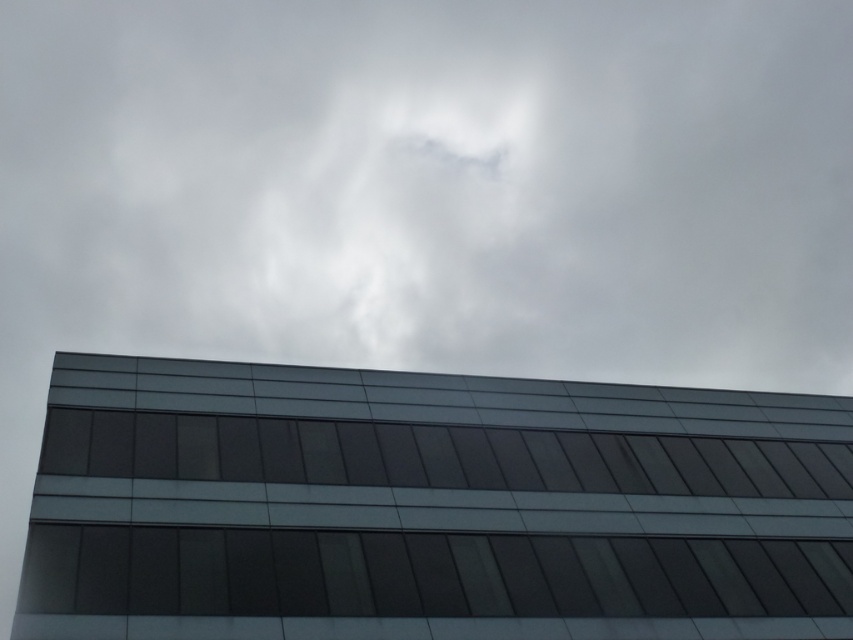
Question: Among these points, which one is farthest from the camera?

Choices:
 (A) (635, 557)
 (B) (257, 472)

Answer: (A)

Question: Does white fluffy cloud at upper center appear on the right side of dark glass window at center?

Choices:
 (A) no
 (B) yes

Answer: (A)

Question: Is white fluffy cloud at upper center thinner than transparent glass window at bottom?

Choices:
 (A) yes
 (B) no

Answer: (B)

Question: Does white fluffy cloud at upper center have a greater width compared to transparent glass window at bottom?

Choices:
 (A) yes
 (B) no

Answer: (A)

Question: Estimate the real-world distances between objects in this image. Which object is farther from the white fluffy cloud at upper center?

Choices:
 (A) transparent glass window at bottom
 (B) dark glass window at center

Answer: (A)

Question: Considering the real-world distances, which object is closest to the dark glass window at center?

Choices:
 (A) white fluffy cloud at upper center
 (B) transparent glass window at bottom

Answer: (B)